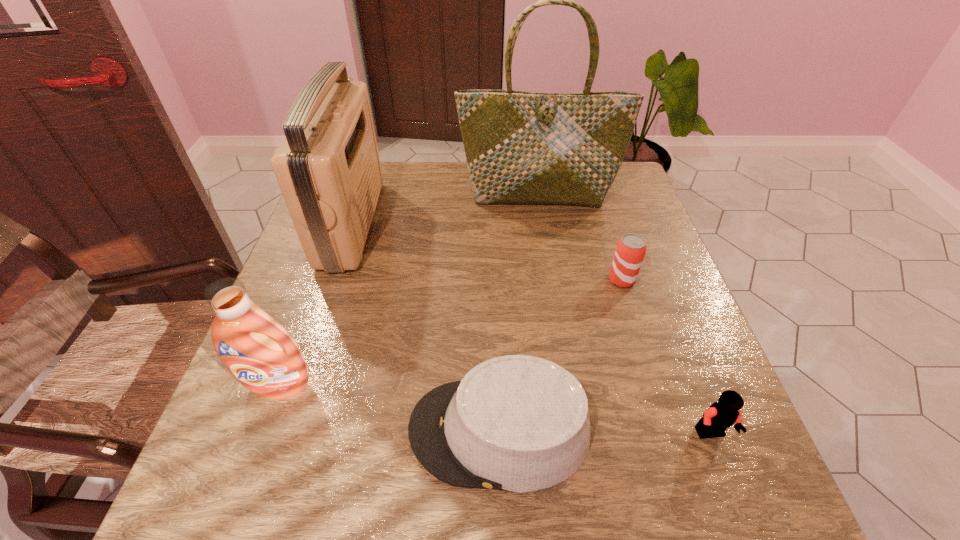
I want to click on blank area located 0.110m on the front-facing side of the Lego, so click(x=744, y=518).

Image resolution: width=960 pixels, height=540 pixels. Find the location of `free space located on the front-facing side of the hat`. free space located on the front-facing side of the hat is located at coordinates (250, 430).

Find the location of a particular element. Image resolution: width=960 pixels, height=540 pixels. vacant region located on the front-facing side of the hat is located at coordinates (255, 430).

You are a GUI agent. You are given a task and a screenshot of the screen. Output one action in this format:
    pyautogui.click(x=<x>, y=<y>)
    Task: Click on the free space located 0.300m on the front-facing side of the hat
    
    Given the screenshot: What is the action you would take?
    pyautogui.click(x=238, y=430)

Find the location of `shopping bag that is at the far edge`. shopping bag that is at the far edge is located at coordinates (521, 147).

The width and height of the screenshot is (960, 540). Identify the location of radio receiver present at the far edge. (328, 168).

Locate an element on the screen. object located at the near edge is located at coordinates (518, 423).

In order to click on radio receiver located in the left edge section of the desktop in this screenshot , I will do `click(328, 168)`.

Where is `detergent at the left edge`? This screenshot has width=960, height=540. detergent at the left edge is located at coordinates (260, 353).

At what (x,y) coordinates should I click in order to perform the action: click on shopping bag that is at the right edge. Please return your answer as a coordinate pair (x, y). The height and width of the screenshot is (540, 960). Looking at the image, I should click on tap(521, 147).